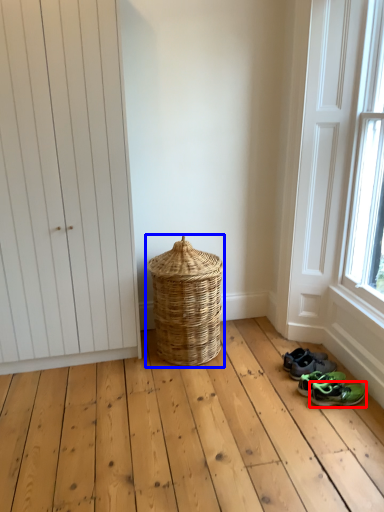
Question: Which object is further to the camera taking this photo, footwear (highlighted by a red box) or basket (highlighted by a blue box)?

Choices:
 (A) footwear
 (B) basket

Answer: (B)